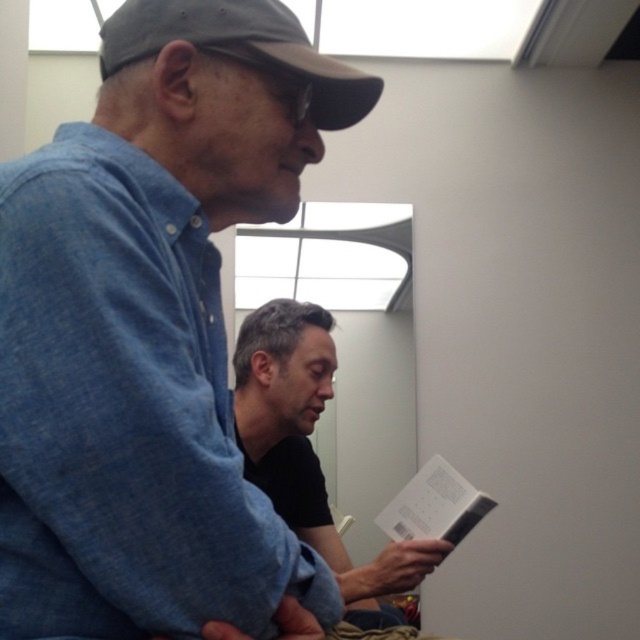
You are trying to place the black matte book at center and the white paper at lower center on a shelf that can only hold items up to 15cm in width. Which item should you place first to ensure both fit?

The white paper at lower center should be placed first since the black matte book at center might be wider and could take up more space, ensuring both fit within the 15cm limit.

You are organizing a small event and need to place a decorative item on the table. The denim shirt at left and the white paper at lower center are available. Which item should you choose if you want something larger?

The denim shirt at left should be chosen because it has a larger size compared to the white paper at lower center.